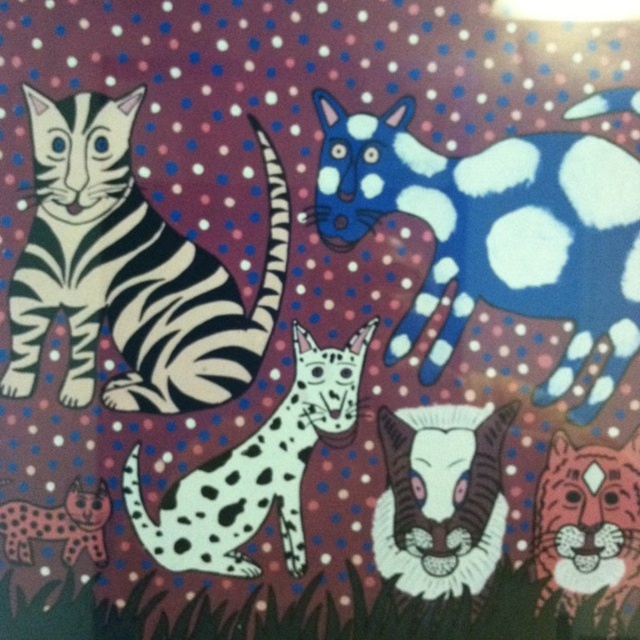
Can you confirm if black and white striped cat at left is wider than spotted fur cat at lower left?

Yes.

Which is more to the left, black and white striped cat at left or spotted fur cat at lower left?

spotted fur cat at lower left is more to the left.

Who is more forward, (170, 275) or (17, 532)?

Positioned in front is point (17, 532).

Where is `black and white striped cat at left`? black and white striped cat at left is located at coordinates (131, 272).

Between black and white striped cat at left and orange tiger face at lower right, which one is positioned higher?

black and white striped cat at left is above.

Measure the distance between point [138,340] and camera.

1.40 meters

Is point (116, 134) positioned after point (636, 570)?

That is False.

Where is `black and white striped cat at left`? The height and width of the screenshot is (640, 640). black and white striped cat at left is located at coordinates (131, 272).

Who is shorter, speckled fur cat at center or white fur cat at center?

white fur cat at center is shorter.

Is point (308, 413) behind point (448, 556)?

That is True.

Which is behind, point (230, 490) or point (408, 454)?

Positioned behind is point (408, 454).

The width and height of the screenshot is (640, 640). I want to click on speckled fur cat at center, so click(x=253, y=470).